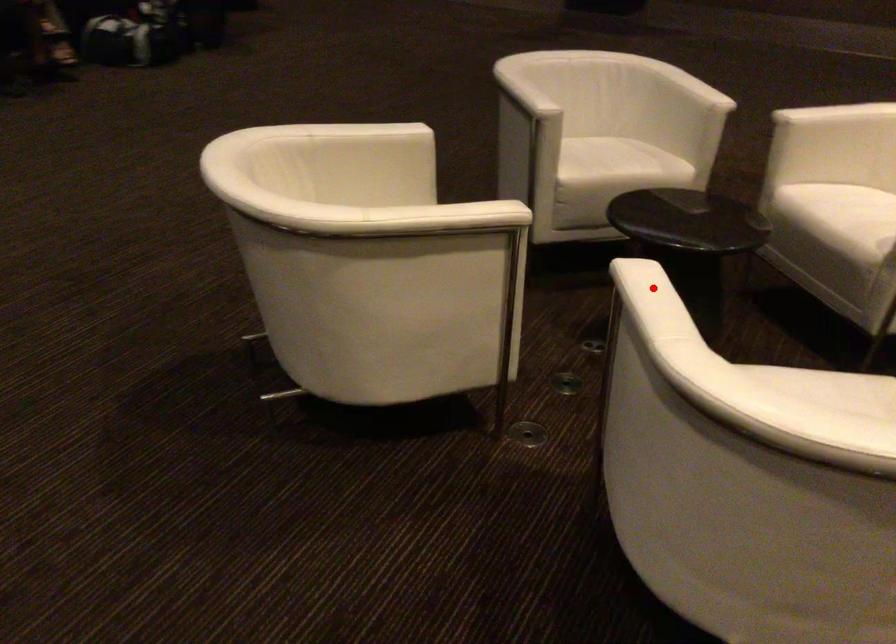
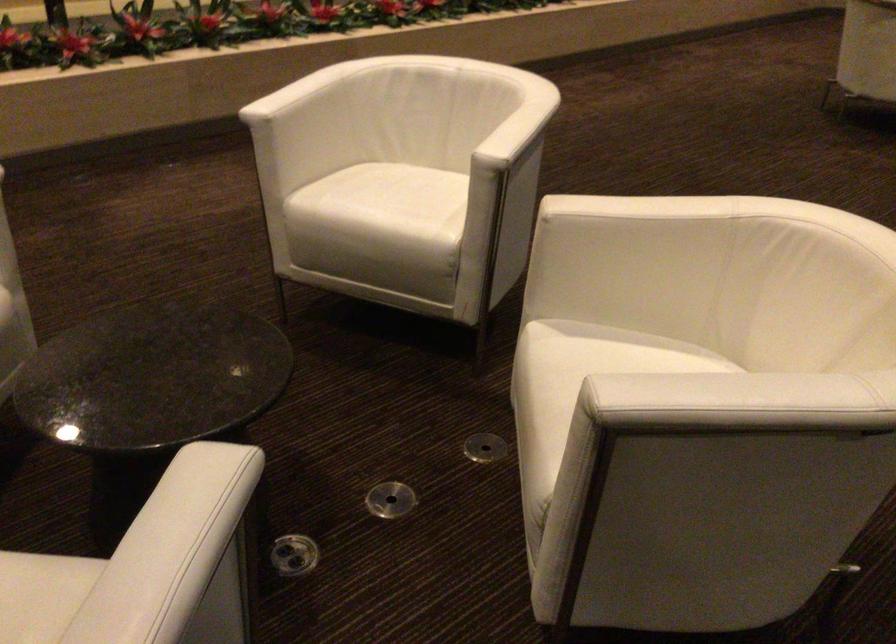
Find the pixel in the second image that matches the highlighted location in the first image.

(515, 122)